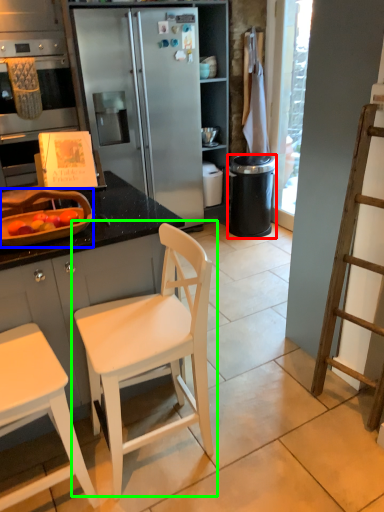
Question: Based on their relative distances, which object is nearer to trash bin/can (highlighted by a red box)? Choose from appliance (highlighted by a blue box) and chair (highlighted by a green box).

Choices:
 (A) appliance
 (B) chair

Answer: (B)